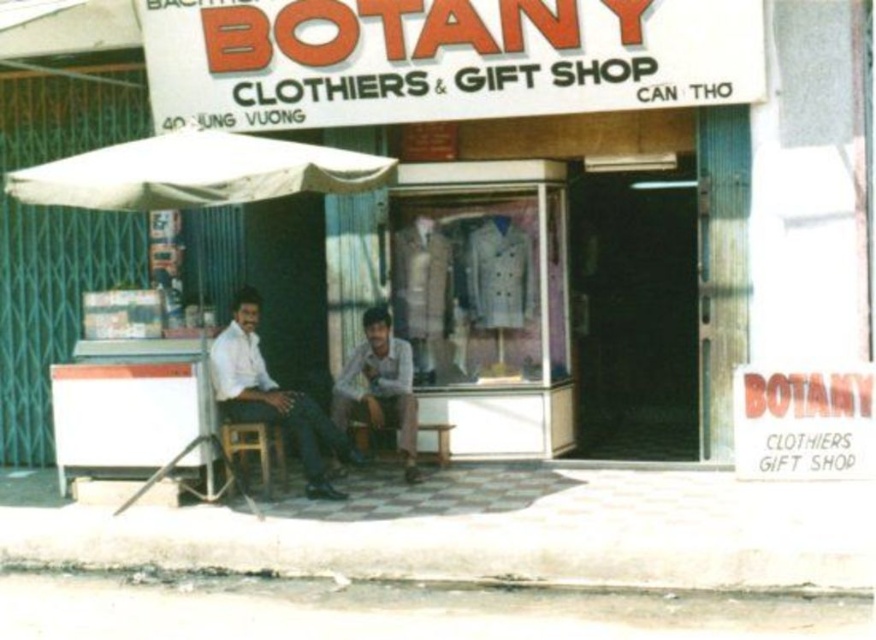
Question: Does white fabric canopy at upper left have a smaller size compared to wooden stool at lower center?

Choices:
 (A) no
 (B) yes

Answer: (A)

Question: Based on their relative distances, which object is nearer to the light brown leather pants at center?

Choices:
 (A) wooden chair at lower left
 (B) wooden stool at lower center
 (C) white fabric canopy at upper left

Answer: (B)

Question: Among these points, which one is farthest from the camera?

Choices:
 (A) (403, 348)
 (B) (179, 132)

Answer: (A)

Question: In this image, where is white fabric canopy at upper left located relative to wooden chair at lower left?

Choices:
 (A) above
 (B) below

Answer: (A)

Question: Is white cotton shirt at center smaller than wooden stool at lower center?

Choices:
 (A) no
 (B) yes

Answer: (A)

Question: Which of the following is the closest to the observer?

Choices:
 (A) light brown leather pants at center
 (B) wooden stool at center
 (C) white cotton shirt at center

Answer: (C)